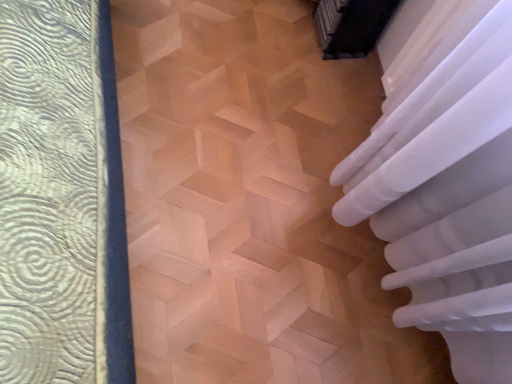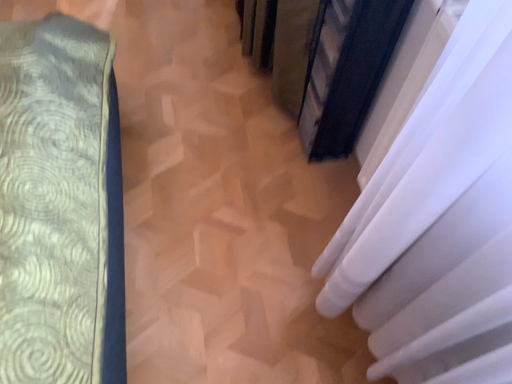
Question: Which way did the camera rotate in the video?

Choices:
 (A) rotated upward
 (B) rotated downward

Answer: (A)